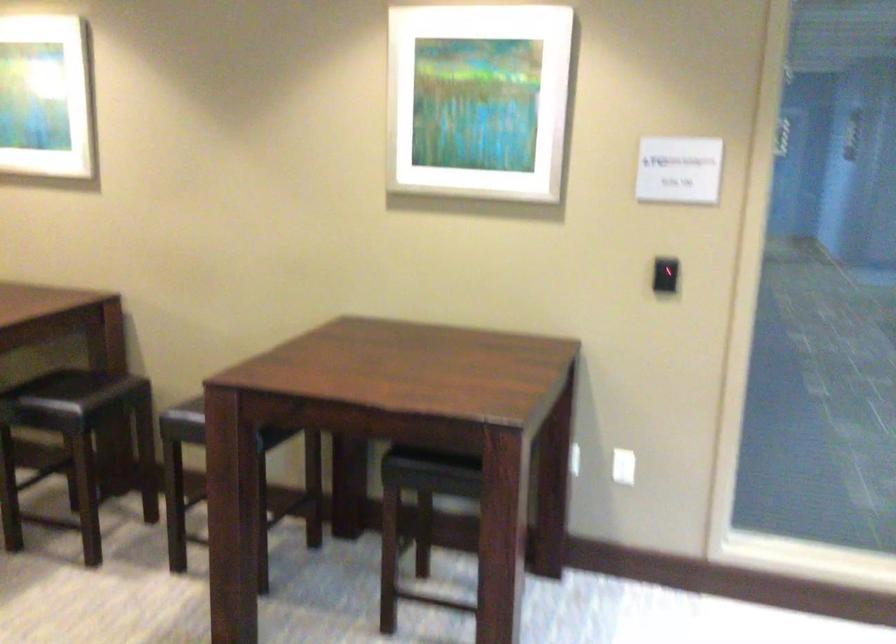
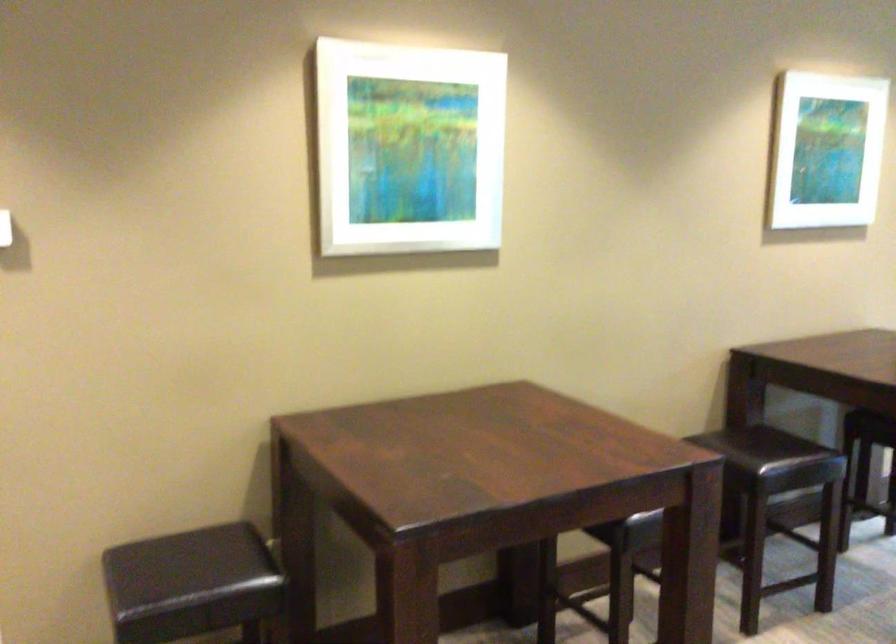
In the second image, find the point that corresponds to pixel 431 129 in the first image.

(824, 149)